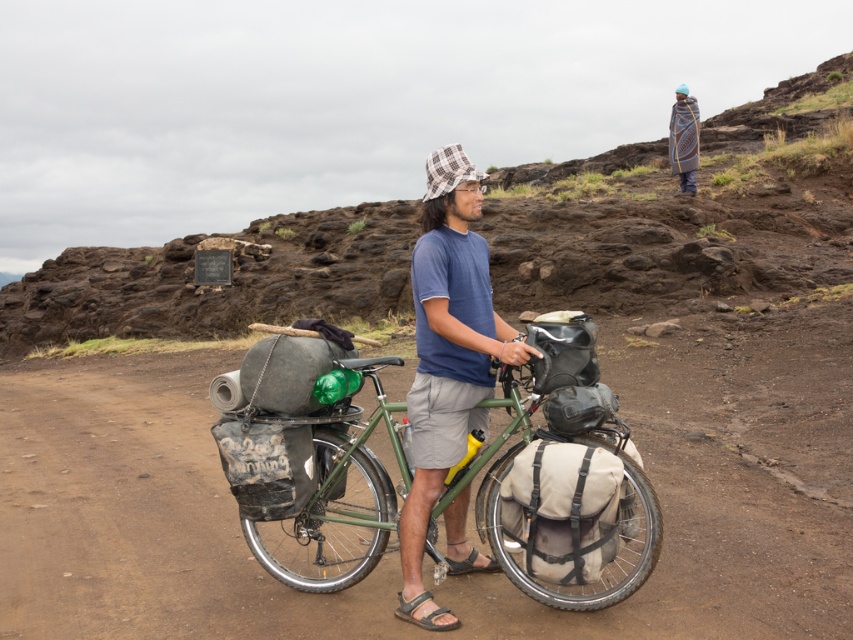
Looking at this image, you are a photographer trying to capture the man and his bicycle in a single frame. The camera you are using has a maximum focus range of 15 inches. Based on the scene, can you include both the green matte bicycle at center and the blue cotton shirt at center in the same photo without moving the camera?

The distance between the green matte bicycle at center and the blue cotton shirt at center is 17.04 inches, which exceeds the camera maximum focus range of 15 inches. Therefore, you cannot include both in the same photo without moving the camera.

You are a hiker carrying a heavy backpack and need to walk along the brown dirt track at center. The path is narrow. Can you safely walk on it if your backpack is 2 feet wide?

The brown dirt track at center is 11.61 feet wide, so yes, you can safely walk on it with a backpack that is 2 feet wide since the path is wider than your backpack.

You are planning to take a photo of the green matte bicycle at center and the blue cotton shirt at center. Since you want both subjects to appear equally prominent in the photo, which one should you zoom in on more?

The green matte bicycle at center is larger in size than the blue cotton shirt at center, so you should zoom in more on the blue cotton shirt at center to make both appear equally prominent.